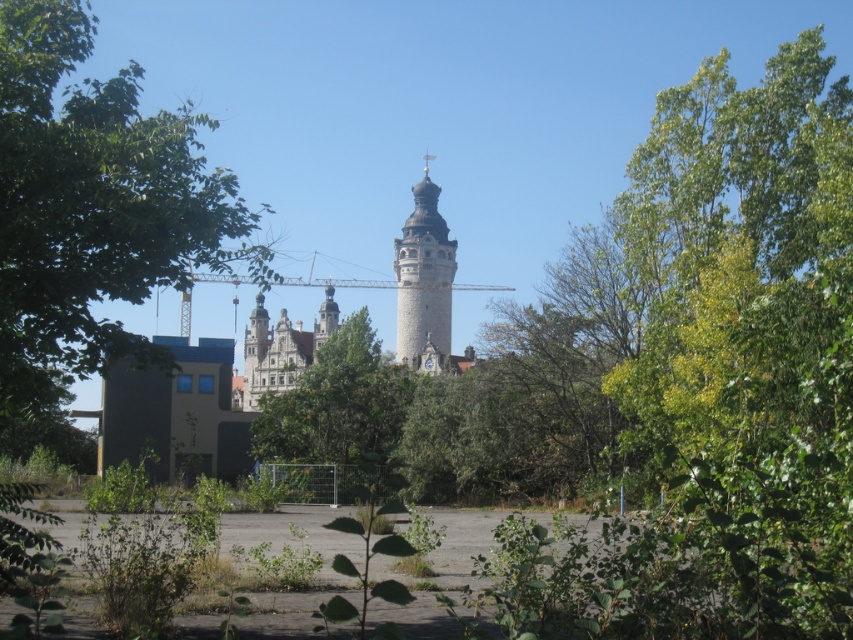
You are planning to plant a new tree that requires at least 30 feet of space between it and any existing structures. Given the distance between the green leafy tree at center and the stone tower at center, would this spacing requirement be satisfied?

The green leafy tree at center and the stone tower at center are 40.09 feet apart, which exceeds the required 30 feet of space. Therefore, the spacing requirement is satisfied.

You are standing in the middle of the scene and want to walk towards the stone tower at center. Which direction should you move to avoid the green leafy tree at center?

Since the green leafy tree at center is to the left of the stone tower at center, you should move to the right to avoid it and head towards the stone tower at center.

Looking at this image, you are standing in the square and want to take a photo of the stone tower at center without the green leafy tree at center blocking the view. Is the tree too large to avoid blocking the tower in your photo?

The green leafy tree at center has a larger size compared to stone tower at center, so the tree may block the view of the tower in your photo depending on your angle and distance.